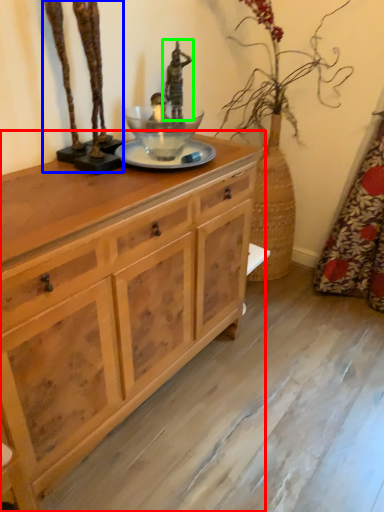
Question: Which is farther away from chest of drawers (highlighted by a red box)? bronze statue (highlighted by a blue box) or sculpture (highlighted by a green box)?

Choices:
 (A) bronze statue
 (B) sculpture

Answer: (B)